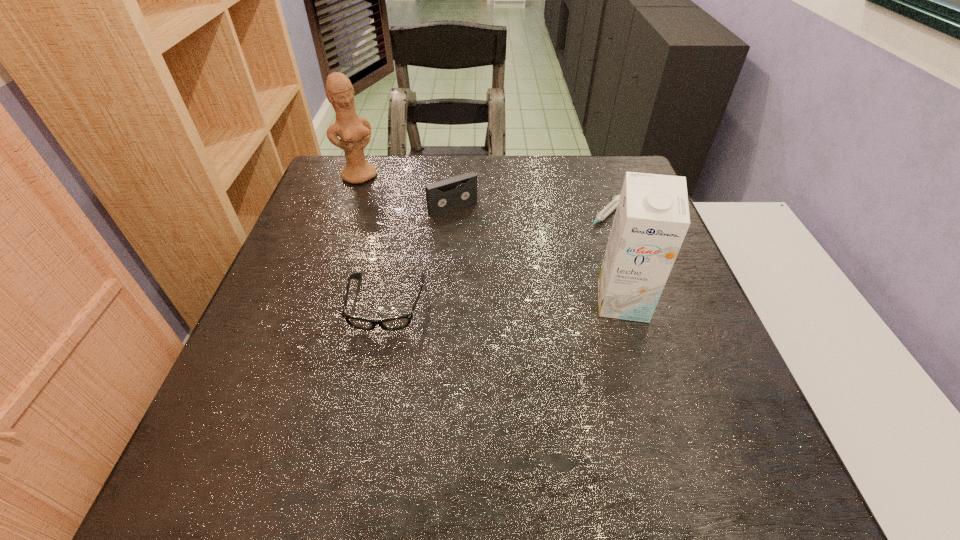
In the image, there is a desktop. Where is `free region at the far right corner`? Image resolution: width=960 pixels, height=540 pixels. free region at the far right corner is located at coordinates (610, 168).

Image resolution: width=960 pixels, height=540 pixels. Identify the location of vacant space that is in between the spectacles and the farthest object. (372, 240).

Where is `free space between the videotape and the carton`? The height and width of the screenshot is (540, 960). free space between the videotape and the carton is located at coordinates (538, 254).

Where is `vacant point located between the second shortest object and the third shortest object`? This screenshot has width=960, height=540. vacant point located between the second shortest object and the third shortest object is located at coordinates (420, 255).

Where is `empty space that is in between the farthest object and the second shortest object`? This screenshot has width=960, height=540. empty space that is in between the farthest object and the second shortest object is located at coordinates (372, 240).

You are a GUI agent. You are given a task and a screenshot of the screen. Output one action in this format:
    pyautogui.click(x=<x>, y=<y>)
    Task: Click on the blank region between the third tallest object and the figurine
    
    Given the screenshot: What is the action you would take?
    pyautogui.click(x=406, y=192)

Locate an element on the screen. This screenshot has width=960, height=540. vacant area between the videotape and the leftmost object is located at coordinates (406, 192).

Image resolution: width=960 pixels, height=540 pixels. Find the location of `free spot between the third shortest object and the syringe`. free spot between the third shortest object and the syringe is located at coordinates (529, 212).

What are the coordinates of `empty space between the spectacles and the carton` in the screenshot? It's located at (504, 302).

Locate an element on the screen. The image size is (960, 540). vacant space in between the figurine and the spectacles is located at coordinates (372, 240).